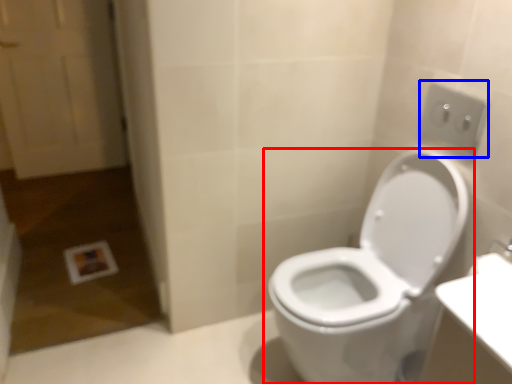
Question: Which point is closer to the camera, toilet (highlighted by a red box) or electric outlet (highlighted by a blue box)?

Choices:
 (A) toilet
 (B) electric outlet

Answer: (A)